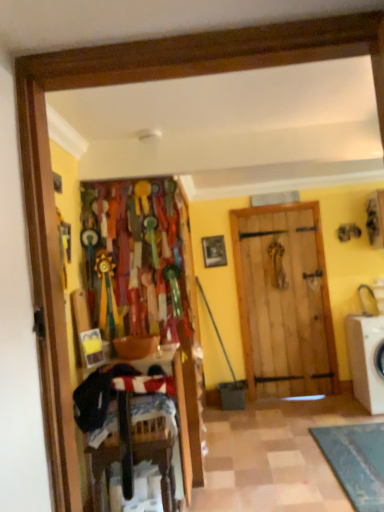
What do you see at coordinates (214, 251) in the screenshot?
I see `wooden picture frame at center` at bounding box center [214, 251].

Identify the location of white plastic washing machine at right. Image resolution: width=384 pixels, height=512 pixels. (367, 360).

From a real-world perspective, which object stands above the other?

wooden picture frame at center is physically above.

Based on the photo, is white plastic washing machine at right bigger or smaller than wooden picture frame at center?

In the image, white plastic washing machine at right appears to be larger than wooden picture frame at center.

Based on the photo, is wooden picture frame at center at the back of white plastic washing machine at right?

No, wooden picture frame at center is not at the back of white plastic washing machine at right.

Choose the correct answer: Is white plastic washing machine at right inside wooden picture frame at center or outside it?

white plastic washing machine at right exists outside the volume of wooden picture frame at center.

Based on the photo, is dark blue fabric laundry at lower left far from wooden picture frame at center?

dark blue fabric laundry at lower left is positioned a significant distance from wooden picture frame at center.

From the image's perspective, is dark blue fabric laundry at lower left beneath wooden picture frame at center?

Yes.

Which object is positioned more to the right, dark blue fabric laundry at lower left or wooden picture frame at center?

Positioned to the right is wooden picture frame at center.

How far apart are dark blue fabric laundry at lower left and wooden picture frame at center?

A distance of 2.54 meters exists between dark blue fabric laundry at lower left and wooden picture frame at center.

Consider the image. Which point is more distant from viewer, (204,257) or (363,389)?

The point (204,257) is farther.

You are a GUI agent. You are given a task and a screenshot of the screen. Output one action in this format:
    pyautogui.click(x=<x>, y=<y>)
    Task: Click on the picture frame located above the white plastic washing machine at right (from the image's perspective)
    
    Given the screenshot: What is the action you would take?
    pyautogui.click(x=214, y=251)

Do you think wooden picture frame at center is within white plastic washing machine at right, or outside of it?

wooden picture frame at center is outside white plastic washing machine at right.

Who is more distant, wooden picture frame at center or white plastic washing machine at right?

wooden picture frame at center.

Identify the location of laundry located on the left of wooden picture frame at center. The height and width of the screenshot is (512, 384). point(115,399).

From a real-world perspective, who is located lower, wooden picture frame at center or dark blue fabric laundry at lower left?

In real-world perspective, dark blue fabric laundry at lower left is lower.

Does wooden picture frame at center appear on the left side of dark blue fabric laundry at lower left?

Incorrect, wooden picture frame at center is not on the left side of dark blue fabric laundry at lower left.

Is wooden picture frame at center looking in the opposite direction of dark blue fabric laundry at lower left?

No.

How many degrees apart are the facing directions of dark blue fabric laundry at lower left and white plastic washing machine at right?

The facing directions of dark blue fabric laundry at lower left and white plastic washing machine at right are 92.8 degrees apart.

Is dark blue fabric laundry at lower left behind white plastic washing machine at right?

No, dark blue fabric laundry at lower left is in front of white plastic washing machine at right.

Can you confirm if dark blue fabric laundry at lower left is wider than white plastic washing machine at right?

No, dark blue fabric laundry at lower left is not wider than white plastic washing machine at right.

From a real-world perspective, between dark blue fabric laundry at lower left and white plastic washing machine at right, who is vertically higher?

dark blue fabric laundry at lower left is physically above.

Which of these two, white plastic washing machine at right or dark blue fabric laundry at lower left, is smaller?

dark blue fabric laundry at lower left.

Is white plastic washing machine at right oriented away from dark blue fabric laundry at lower left?

No, dark blue fabric laundry at lower left is not at the back of white plastic washing machine at right.

Would you say white plastic washing machine at right is a long distance from dark blue fabric laundry at lower left?

That's right, there is a large distance between white plastic washing machine at right and dark blue fabric laundry at lower left.

Which object is wider, white plastic washing machine at right or dark blue fabric laundry at lower left?

Wider between the two is white plastic washing machine at right.

This screenshot has width=384, height=512. Identify the location of picture frame above the white plastic washing machine at right (from a real-world perspective). (214, 251).

Locate an element on the screen. picture frame behind the dark blue fabric laundry at lower left is located at coordinates (214, 251).

Based on their spatial positions, is dark blue fabric laundry at lower left or white plastic washing machine at right further from wooden picture frame at center?

dark blue fabric laundry at lower left lies further to wooden picture frame at center than the other object.

From the image, which object appears to be nearer to white plastic washing machine at right, dark blue fabric laundry at lower left or wooden picture frame at center?

Based on the image, wooden picture frame at center appears to be nearer to white plastic washing machine at right.

Considering their positions, is white plastic washing machine at right positioned closer to dark blue fabric laundry at lower left than wooden picture frame at center?

The object closer to dark blue fabric laundry at lower left is white plastic washing machine at right.

Which object lies further to the anchor point white plastic washing machine at right, wooden picture frame at center or dark blue fabric laundry at lower left?

Based on the image, dark blue fabric laundry at lower left appears to be further to white plastic washing machine at right.

From the image, which object appears to be nearer to dark blue fabric laundry at lower left, wooden picture frame at center or white plastic washing machine at right?

white plastic washing machine at right.

Estimate the real-world distances between objects in this image. Which object is further from wooden picture frame at center, white plastic washing machine at right or dark blue fabric laundry at lower left?

The object further to wooden picture frame at center is dark blue fabric laundry at lower left.

Find the location of a particular element. washing machine positioned between dark blue fabric laundry at lower left and wooden picture frame at center from near to far is located at coordinates (367, 360).